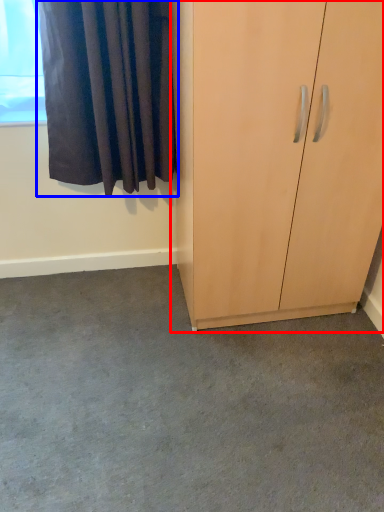
Question: Which point is closer to the camera, cupboard (highlighted by a red box) or curtain (highlighted by a blue box)?

Choices:
 (A) cupboard
 (B) curtain

Answer: (A)